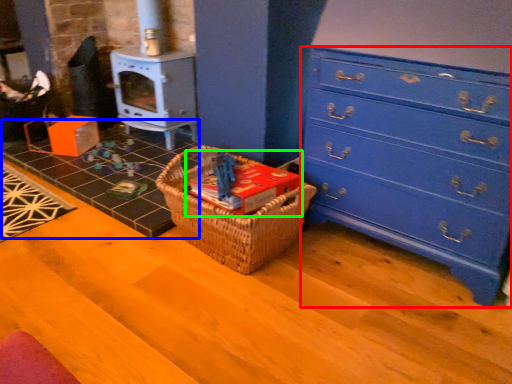
Question: Which is nearer to the chest of drawers (highlighted by a red box)? tile (highlighted by a blue box) or book (highlighted by a green box).

Choices:
 (A) tile
 (B) book

Answer: (B)